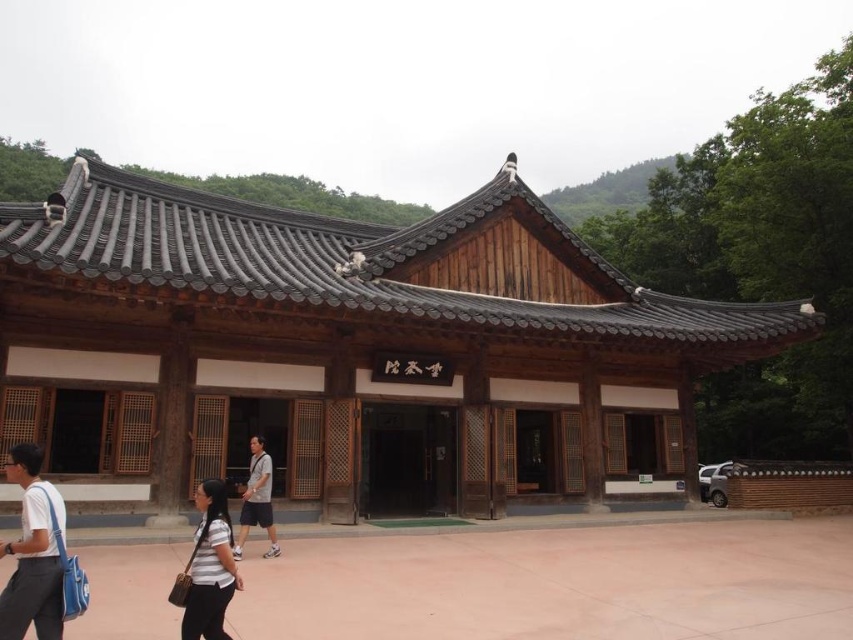
Question: Which point is farther to the camera?

Choices:
 (A) gray fabric shirt at center
 (B) striped fabric shirt at lower center

Answer: (A)

Question: Does white cotton shirt at lower left have a greater width compared to gray fabric shirt at center?

Choices:
 (A) no
 (B) yes

Answer: (A)

Question: Which object appears closest to the camera in this image?

Choices:
 (A) white cotton shirt at lower left
 (B) striped fabric shirt at lower center

Answer: (A)

Question: Where is brown wooden temple at center located in relation to striped fabric shirt at lower center in the image?

Choices:
 (A) right
 (B) left

Answer: (A)

Question: Among these points, which one is nearest to the camera?

Choices:
 (A) [227, 435]
 (B) [210, 573]
 (C) [61, 582]

Answer: (C)

Question: Is white cotton shirt at lower left wider than striped fabric shirt at lower center?

Choices:
 (A) no
 (B) yes

Answer: (B)